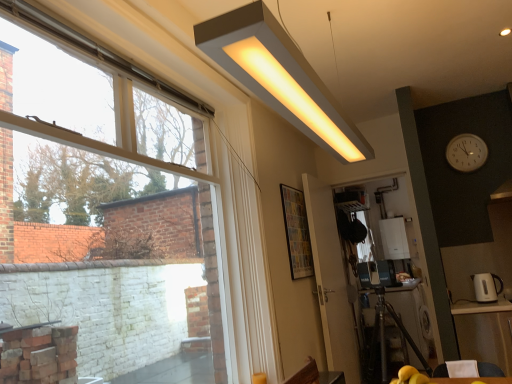
Measure the distance between white glossy boiler at center, the 1th appliance positioned from the back, and camera.

white glossy boiler at center, the 1th appliance positioned from the back, and camera are 5.00 meters apart from each other.

Where is `white glossy boiler at center, which is the 2th appliance in front-to-back order`? This screenshot has width=512, height=384. white glossy boiler at center, which is the 2th appliance in front-to-back order is located at coordinates (394, 238).

In the scene shown: What is the approximate width of transparent plastic screen door at center, the first screen door positioned from the left?

transparent plastic screen door at center, the first screen door positioned from the left, is 4.67 inches in width.

How much space does white glossy screen door at lower right, positioned as the first screen door in right-to-left order, occupy vertically?

It is 1.95 meters.

In order to face white glossy screen door at lower right, positioned as the first screen door in right-to-left order, should I rotate leftwards or rightwards?

You should look right and rotate roughly 16.703 degrees.

In order to click on matte white rectangular light fixture at upper center in this screenshot , I will do pos(280,77).

In the image, is wooden table at lower right, acting as the 2th table starting from the front, on the left side or the right side of wooden table at lower right, acting as the first table starting from the front?

wooden table at lower right, acting as the 2th table starting from the front, is to the left of wooden table at lower right, acting as the first table starting from the front.

From the image's perspective, which one is positioned higher, wooden table at lower right, the first table in the back-to-front sequence, or wooden table at lower right, which is the second table in back-to-front order?

wooden table at lower right, which is the second table in back-to-front order, appears higher in the image.

How many degrees apart are the facing directions of wooden table at lower right, acting as the 2th table starting from the front, and wooden table at lower right, which is the second table in back-to-front order?

The angle between the facing direction of wooden table at lower right, acting as the 2th table starting from the front, and the facing direction of wooden table at lower right, which is the second table in back-to-front order, is 89.5 degrees.

From a real-world perspective, is wooden table at lower right, acting as the first table starting from the front, physically located above or below white glossy electric kettle at right, which is the second appliance from back to front?

Clearly, from a real-world perspective, wooden table at lower right, acting as the first table starting from the front, is below white glossy electric kettle at right, which is the second appliance from back to front.

From the image's perspective, is wooden table at lower right, which is the second table in back-to-front order, located above or below white glossy electric kettle at right, which is the 1th appliance from front to back?

Based on their image positions, wooden table at lower right, which is the second table in back-to-front order, is located beneath white glossy electric kettle at right, which is the 1th appliance from front to back.

Which is behind, wooden table at lower right, acting as the first table starting from the front, or white glossy electric kettle at right, which is the 1th appliance from front to back?

white glossy electric kettle at right, which is the 1th appliance from front to back, is further from the camera.

Would you say wooden table at lower right, which is the second table in back-to-front order, is outside white glossy electric kettle at right, which is the second appliance from back to front?

Absolutely, wooden table at lower right, which is the second table in back-to-front order, is external to white glossy electric kettle at right, which is the second appliance from back to front.

From a real-world perspective, does wooden table at lower right, the first table in the back-to-front sequence, sit lower than white glossy boiler at center, which is the 2th appliance in front-to-back order?

Indeed, from a real-world perspective, wooden table at lower right, the first table in the back-to-front sequence, is positioned beneath white glossy boiler at center, which is the 2th appliance in front-to-back order.

Is wooden table at lower right, the first table in the back-to-front sequence, closer to the viewer compared to white glossy boiler at center, which is the first appliance from right to left?

Yes, wooden table at lower right, the first table in the back-to-front sequence, is in front of white glossy boiler at center, which is the first appliance from right to left.

Is wooden table at lower right, acting as the 2th table starting from the front, touching white glossy boiler at center, marked as the second appliance in a left-to-right arrangement?

wooden table at lower right, acting as the 2th table starting from the front, is not next to white glossy boiler at center, marked as the second appliance in a left-to-right arrangement, and they're not touching.

Is point (413, 341) positioned after point (394, 242)?

No, it is not.

Considering the positions of objects transparent glass window at upper left and white glossy boiler at center, which is the 2th appliance in front-to-back order, in the image provided, who is more to the left, transparent glass window at upper left or white glossy boiler at center, which is the 2th appliance in front-to-back order,?

transparent glass window at upper left.

The height and width of the screenshot is (384, 512). In order to click on the 2nd appliance behind the transparent glass window at upper left in this screenshot , I will do `click(394, 238)`.

From the image's perspective, is transparent glass window at upper left above white glossy boiler at center, marked as the second appliance in a left-to-right arrangement?

Yes, from the image's perspective, transparent glass window at upper left is on top of white glossy boiler at center, marked as the second appliance in a left-to-right arrangement.

Considering the positions of objects transparent glass window at upper left and transparent plastic screen door at center, the second screen door from the right, in the image provided, who is behind, transparent glass window at upper left or transparent plastic screen door at center, the second screen door from the right,?

transparent plastic screen door at center, the second screen door from the right, is behind.

From a real-world perspective, is transparent glass window at upper left beneath transparent plastic screen door at center, the second screen door from the right?

No, from a real-world perspective, transparent glass window at upper left is not under transparent plastic screen door at center, the second screen door from the right.

From the image's perspective, is transparent glass window at upper left positioned above or below transparent plastic screen door at center, the first screen door positioned from the left?

transparent glass window at upper left is above transparent plastic screen door at center, the first screen door positioned from the left.

Can you confirm if transparent glass window at upper left is smaller than transparent plastic screen door at center, the second screen door from the right?

No.

Is white glossy electric kettle at right, which is the 1th appliance from front to back, completely or partially inside wooden table at lower right, acting as the 2th table starting from the front?

Actually, white glossy electric kettle at right, which is the 1th appliance from front to back, is outside wooden table at lower right, acting as the 2th table starting from the front.

Which point is more forward, [398,322] or [486,295]?

→ The point [486,295] is closer to the camera.

Considering the positions of objects wooden table at lower right, the first table in the back-to-front sequence, and white glossy electric kettle at right, which is the 1th appliance from front to back, in the image provided, who is more to the right, wooden table at lower right, the first table in the back-to-front sequence, or white glossy electric kettle at right, which is the 1th appliance from front to back,?

From the viewer's perspective, white glossy electric kettle at right, which is the 1th appliance from front to back, appears more on the right side.

In terms of size, does wooden table at lower right, the first table in the back-to-front sequence, appear bigger or smaller than white glossy electric kettle at right, which is the second appliance from back to front?

In the image, wooden table at lower right, the first table in the back-to-front sequence, appears to be larger than white glossy electric kettle at right, which is the second appliance from back to front.

Which is in front, point (367, 375) or point (26, 142)?

Positioned in front is point (26, 142).

I want to click on window above the wooden table at lower right, acting as the 2th table starting from the front (from a real-world perspective), so click(89, 145).

How far apart are wooden table at lower right, acting as the 2th table starting from the front, and transparent glass window at upper left?

8.62 feet.

Considering the relative sizes of wooden table at lower right, acting as the 2th table starting from the front, and transparent glass window at upper left in the image provided, is wooden table at lower right, acting as the 2th table starting from the front, shorter than transparent glass window at upper left?

Indeed, wooden table at lower right, acting as the 2th table starting from the front, has a lesser height compared to transparent glass window at upper left.

This screenshot has width=512, height=384. In order to click on table lying behind the wooden table at lower right, acting as the first table starting from the front in this screenshot , I will do `click(384, 335)`.

Where is `table in front of the white glossy electric kettle at right, which is counted as the first appliance, starting from the left`? The height and width of the screenshot is (384, 512). table in front of the white glossy electric kettle at right, which is counted as the first appliance, starting from the left is located at coordinates (485, 332).

Based on their spatial positions, is white plastic clock at upper right or transparent plastic screen door at center, the second screen door from the right, closer to transparent glass window at upper left?

transparent plastic screen door at center, the second screen door from the right.

When comparing their distances from wooden table at lower right, acting as the 2th table starting from the front, does matte white rectangular light fixture at upper center or white glossy screen door at lower right, positioned as the first screen door in right-to-left order, seem closer?

The object closer to wooden table at lower right, acting as the 2th table starting from the front, is white glossy screen door at lower right, positioned as the first screen door in right-to-left order.

Considering their positions, is white plastic clock at upper right positioned further to transparent plastic screen door at center, the second screen door from the right, than matte white rectangular light fixture at upper center?

matte white rectangular light fixture at upper center is further to transparent plastic screen door at center, the second screen door from the right.

When comparing their distances from wooden table at lower right, which is the second table in back-to-front order, does transparent plastic screen door at center, the second screen door from the right, or transparent glass window at upper left seem closer?

The object closer to wooden table at lower right, which is the second table in back-to-front order, is transparent plastic screen door at center, the second screen door from the right.

Estimate the real-world distances between objects in this image. Which object is closer to matte white rectangular light fixture at upper center, white glossy electric kettle at right, placed as the second appliance when sorted from right to left, or transparent plastic screen door at center, the first screen door positioned from the left?

transparent plastic screen door at center, the first screen door positioned from the left, is positioned closer to the anchor matte white rectangular light fixture at upper center.

Based on their spatial positions, is transparent plastic screen door at center, the second screen door from the right, or white glossy electric kettle at right, which is the 1th appliance from front to back, further from wooden table at lower right, acting as the 2th table starting from the front?

white glossy electric kettle at right, which is the 1th appliance from front to back, lies further to wooden table at lower right, acting as the 2th table starting from the front, than the other object.

Looking at the image, which one is located closer to matte white rectangular light fixture at upper center, transparent plastic screen door at center, the first screen door positioned from the left, or white plastic clock at upper right?

transparent plastic screen door at center, the first screen door positioned from the left.

Estimate the real-world distances between objects in this image. Which object is closer to transparent glass window at upper left, matte white rectangular light fixture at upper center or transparent plastic screen door at center, the first screen door positioned from the left?

transparent plastic screen door at center, the first screen door positioned from the left, lies closer to transparent glass window at upper left than the other object.

I want to click on appliance between wooden table at lower right, which is the second table in back-to-front order, and white glossy boiler at center, the 1th appliance positioned from the back, along the z-axis, so click(486, 287).

This screenshot has height=384, width=512. I want to click on window between matte white rectangular light fixture at upper center and white glossy screen door at lower right, positioned as the first screen door in right-to-left order, from front to back, so click(89, 145).

In order to click on appliance positioned between transparent glass window at upper left and white glossy boiler at center, the 1th appliance positioned from the back, from near to far in this screenshot , I will do `click(486, 287)`.

This screenshot has height=384, width=512. I want to click on table between white plastic clock at upper right and wooden table at lower right, the first table in the back-to-front sequence, vertically, so 485,332.